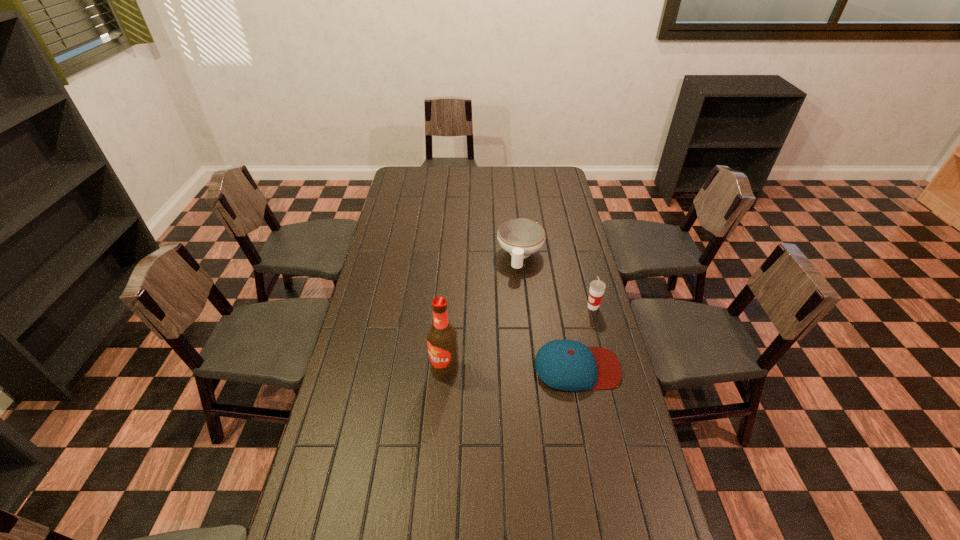
Where is `the leftmost object`? the leftmost object is located at coordinates (442, 341).

The height and width of the screenshot is (540, 960). What are the coordinates of `beer bottle` in the screenshot? It's located at (442, 341).

Find the location of a particular element. baseball cap is located at coordinates (568, 365).

The width and height of the screenshot is (960, 540). I want to click on the second farthest object, so click(x=597, y=287).

Where is `the second tallest object`? the second tallest object is located at coordinates (597, 287).

Identify the location of chinaware. Image resolution: width=960 pixels, height=540 pixels. (520, 237).

Locate an element on the screen. The height and width of the screenshot is (540, 960). the farthest object is located at coordinates (520, 237).

Locate an element on the screen. free spot located 0.180m on the back of the tallest object is located at coordinates (448, 319).

Where is `free region located 0.210m on the side of the second farthest object with the logo`? The height and width of the screenshot is (540, 960). free region located 0.210m on the side of the second farthest object with the logo is located at coordinates (548, 337).

Locate an element on the screen. The image size is (960, 540). free point located on the side of the second farthest object with the logo is located at coordinates (546, 339).